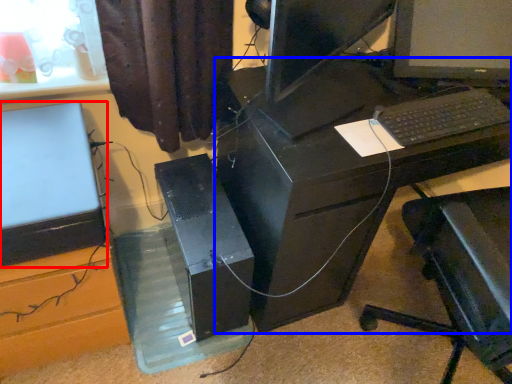
Question: Which of the following is the closest to the observer, computer (highlighted by a red box) or desk (highlighted by a blue box)?

Choices:
 (A) computer
 (B) desk

Answer: (A)